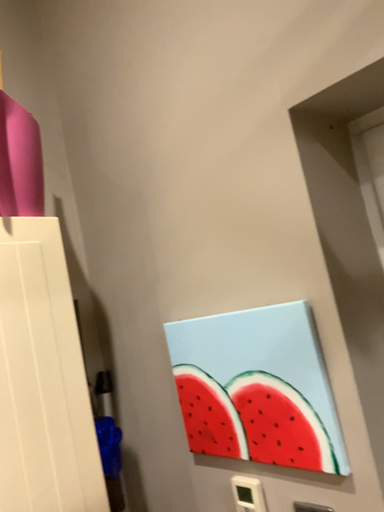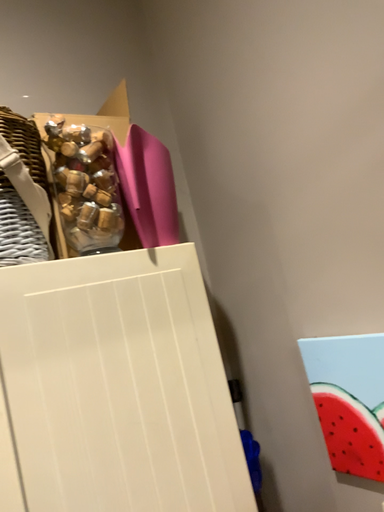
Question: How did the camera likely rotate when shooting the video?

Choices:
 (A) rotated left
 (B) rotated right

Answer: (A)